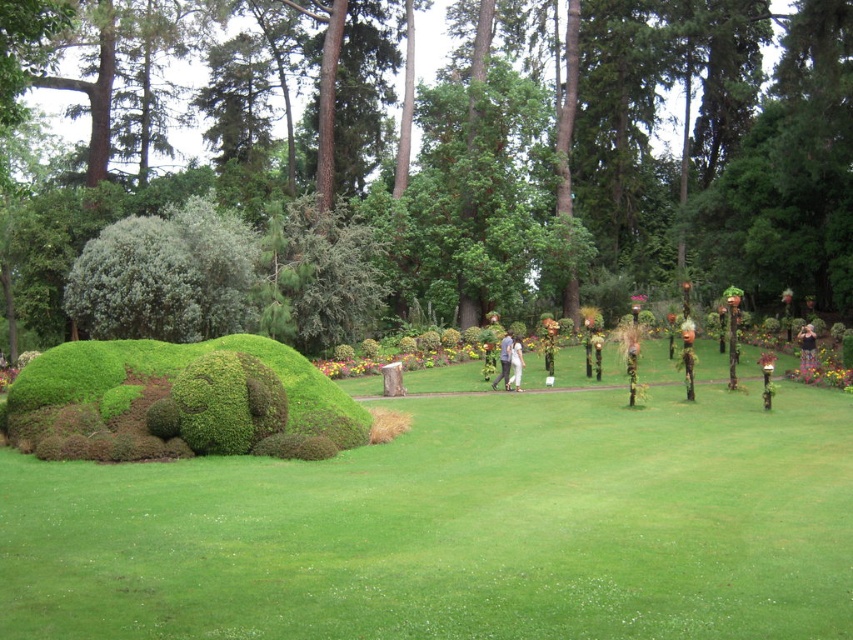
You are planning to host a picnic in the garden. You have a picnic blanket that can cover an area larger than the floral dress at center. Will the green grass at center provide enough space for your picnic blanket?

The green grass at center has a larger size compared to the floral dress at center, so yes, the green grass at center will provide enough space for your picnic blanket since it is bigger than the floral dress at center.

You are a photographer planning to take a photo of the floral dress at center and the green grass at center. Based on their positions, which object is located to the left of the other?

The green grass at center is positioned on the left side of the floral dress at center.

You are a photographer standing in the garden and want to capture a photo of the white cotton pants at center and the green grass at center. Which object is located to the left of the other?

The green grass at center is positioned on the left side of white cotton pants at center.